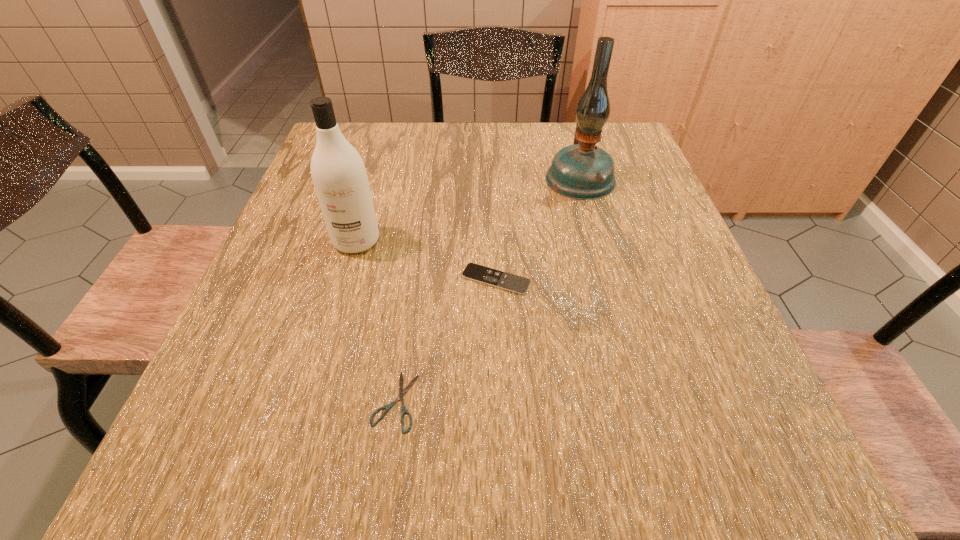
At what (x,y) coordinates should I click in order to perform the action: click on free space at the near right corner of the desktop. Please return your answer as a coordinate pair (x, y). The height and width of the screenshot is (540, 960). Looking at the image, I should click on (803, 495).

The width and height of the screenshot is (960, 540). What are the coordinates of `free spot between the second nearest object and the second object from left to right` in the screenshot? It's located at (445, 340).

At what (x,y) coordinates should I click in order to perform the action: click on empty space that is in between the third farthest object and the oil lamp. Please return your answer as a coordinate pair (x, y). The height and width of the screenshot is (540, 960). Looking at the image, I should click on (538, 229).

Where is `vacant point located between the shears and the third tallest object`? This screenshot has width=960, height=540. vacant point located between the shears and the third tallest object is located at coordinates (445, 340).

Where is `unoccupied area between the shampoo and the second object from right to left`? unoccupied area between the shampoo and the second object from right to left is located at coordinates (426, 260).

Where is `free space between the leftmost object and the second object from left to right`? free space between the leftmost object and the second object from left to right is located at coordinates (375, 321).

Find the location of `unoccupied position between the rightmost object and the leftmost object`. unoccupied position between the rightmost object and the leftmost object is located at coordinates (468, 210).

Locate an element on the screen. The image size is (960, 540). vacant point located between the farthest object and the leftmost object is located at coordinates (468, 210).

Where is `free point between the shampoo and the third tallest object`? This screenshot has width=960, height=540. free point between the shampoo and the third tallest object is located at coordinates (426, 260).

Identify the location of free space between the shortest object and the rightmost object. (488, 289).